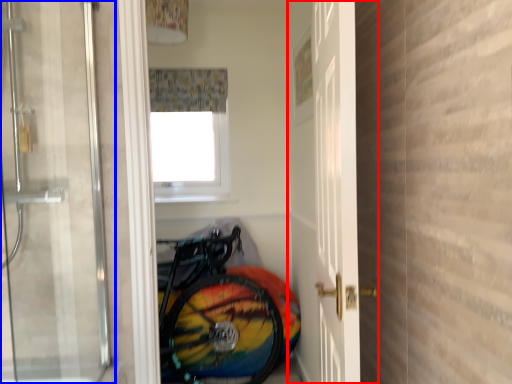
Question: Which object appears farthest to the camera in this image, door (highlighted by a red box) or door (highlighted by a blue box)?

Choices:
 (A) door
 (B) door

Answer: (A)